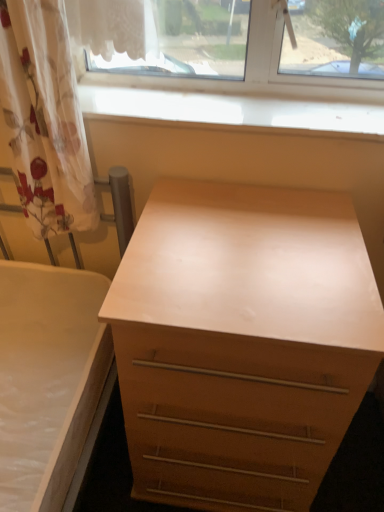
Question: Considering the relative positions of light wood chest of drawers at center and smooth wood window sill at upper center in the image provided, is light wood chest of drawers at center in front of smooth wood window sill at upper center?

Choices:
 (A) yes
 (B) no

Answer: (A)

Question: From the image's perspective, is light wood chest of drawers at center located above smooth wood window sill at upper center?

Choices:
 (A) no
 (B) yes

Answer: (A)

Question: From a real-world perspective, is light wood chest of drawers at center physically below smooth wood window sill at upper center?

Choices:
 (A) no
 (B) yes

Answer: (B)

Question: Can you confirm if light wood chest of drawers at center is wider than smooth wood window sill at upper center?

Choices:
 (A) no
 (B) yes

Answer: (B)

Question: Is there a large distance between light wood chest of drawers at center and smooth wood window sill at upper center?

Choices:
 (A) no
 (B) yes

Answer: (A)

Question: Is translucent floral fabric at left in front of or behind light wood chest of drawers at center in the image?

Choices:
 (A) front
 (B) behind

Answer: (B)

Question: Looking at the image, does translucent floral fabric at left seem bigger or smaller compared to light wood chest of drawers at center?

Choices:
 (A) big
 (B) small

Answer: (B)

Question: In terms of width, does translucent floral fabric at left look wider or thinner when compared to light wood chest of drawers at center?

Choices:
 (A) wide
 (B) thin

Answer: (B)

Question: From the image's perspective, relative to light wood chest of drawers at center, is translucent floral fabric at left above or below?

Choices:
 (A) above
 (B) below

Answer: (A)

Question: Considering the positions of point (119, 89) and point (200, 379), is point (119, 89) closer or farther from the camera than point (200, 379)?

Choices:
 (A) closer
 (B) farther

Answer: (B)

Question: Is smooth wood window sill at upper center taller or shorter than light wood chest of drawers at center?

Choices:
 (A) tall
 (B) short

Answer: (B)

Question: In terms of width, does smooth wood window sill at upper center look wider or thinner when compared to light wood chest of drawers at center?

Choices:
 (A) thin
 (B) wide

Answer: (A)

Question: From the image's perspective, is smooth wood window sill at upper center located above or below light wood chest of drawers at center?

Choices:
 (A) above
 (B) below

Answer: (A)

Question: In terms of size, does light wood chest of drawers at center appear bigger or smaller than smooth wood window sill at upper center?

Choices:
 (A) small
 (B) big

Answer: (B)

Question: Is light wood chest of drawers at center inside or outside of smooth wood window sill at upper center?

Choices:
 (A) inside
 (B) outside

Answer: (B)